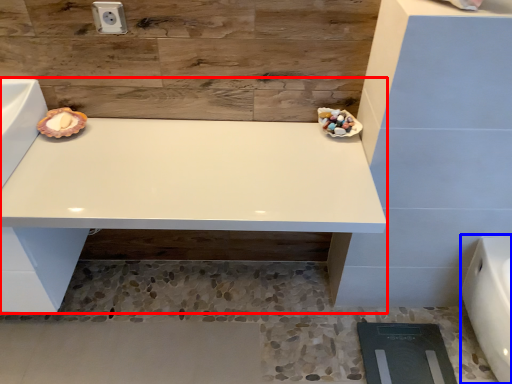
Question: Which object is further to the camera taking this photo, vanity (highlighted by a red box) or porcelain (highlighted by a blue box)?

Choices:
 (A) vanity
 (B) porcelain

Answer: (B)